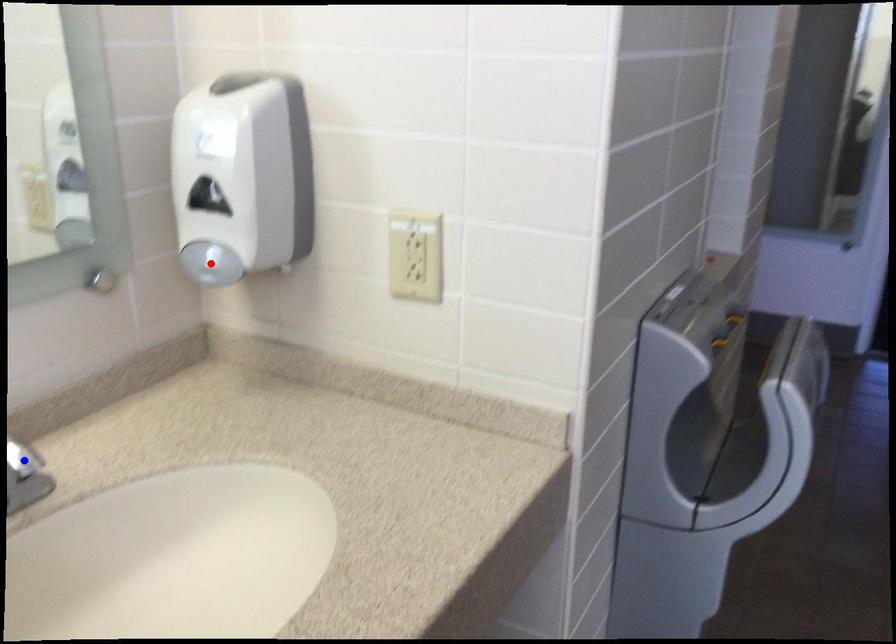
Question: Which of the two points in the image is closer to the camera?

Choices:
 (A) Blue point is closer.
 (B) Red point is closer.

Answer: (A)